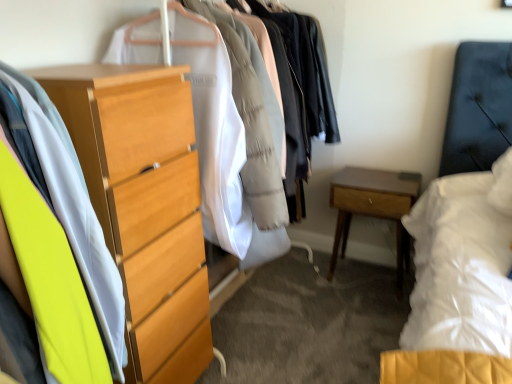
Question: From the image's perspective, relative to light wood chest of drawers at left, is light brown wood nightstand at lower right above or below?

Choices:
 (A) above
 (B) below

Answer: (B)

Question: Is point (336, 208) closer or farther from the camera than point (120, 256)?

Choices:
 (A) farther
 (B) closer

Answer: (A)

Question: Which is farther from the light wood dresser at left, which is counted as the 1th closet, starting from the front?

Choices:
 (A) light brown wood nightstand at lower right
 (B) wooden chest of drawers at center, which ranks as the second closet in front-to-back order
 (C) light wood chest of drawers at left

Answer: (A)

Question: Which object is positioned farthest from the wooden chest of drawers at center, which ranks as the second closet in front-to-back order?

Choices:
 (A) light wood chest of drawers at left
 (B) light wood dresser at left, which is the second closet in back-to-front order
 (C) light brown wood nightstand at lower right

Answer: (C)